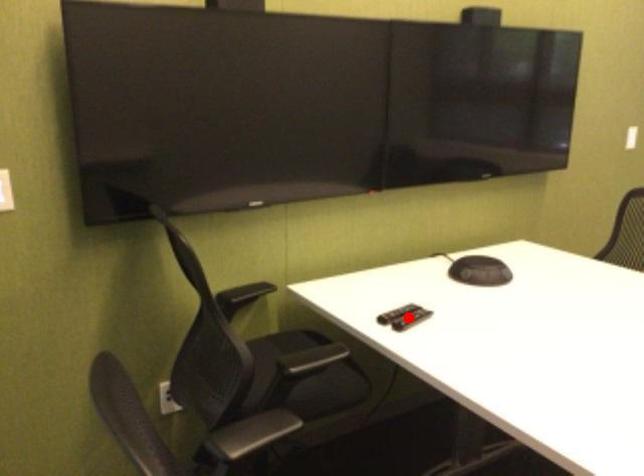
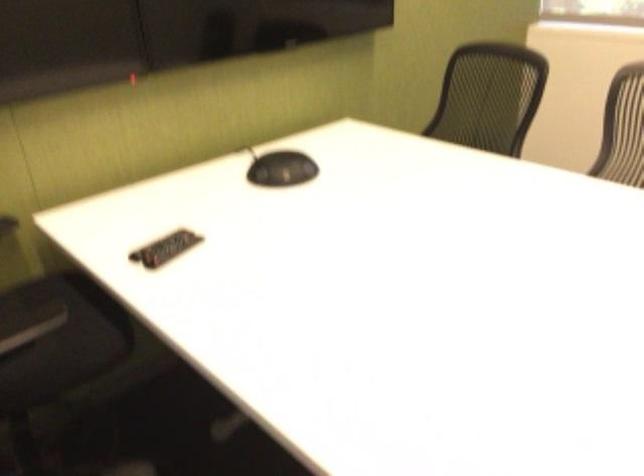
Find the pixel in the second image that matches the highlighted location in the first image.

(165, 248)